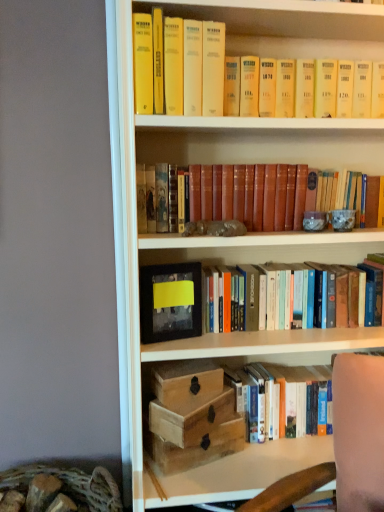
Measure the distance between point (271, 370) and camera.

They are 4.73 feet apart.

The width and height of the screenshot is (384, 512). What do you see at coordinates (193, 415) in the screenshot?
I see `wooden box at center, marked as the 1th box in a bottom-to-top arrangement` at bounding box center [193, 415].

Where is `matte black picture frame at center`? The width and height of the screenshot is (384, 512). matte black picture frame at center is located at coordinates (170, 302).

Which is behind, point (182, 324) or point (280, 323)?

The point (280, 323) is more distant.

In the scene shown: Does matte black picture frame at center have a lesser width compared to hardcover books at center, placed as the second book when sorted from top to bottom?

Yes.

Does matte black picture frame at center appear on the right side of hardcover books at center, arranged as the 2th book when ordered from the bottom?

Incorrect, matte black picture frame at center is not on the right side of hardcover books at center, arranged as the 2th book when ordered from the bottom.

Can you see matte black picture frame at center touching hardcover books at center, arranged as the 2th book when ordered from the bottom?

No.

From a real-world perspective, which object stands above the other?

wooden box at center, from a real-world perspective.

Between wooden box at center and wooden box at center, marked as the 1th box in a bottom-to-top arrangement, which one has larger width?

wooden box at center, marked as the 1th box in a bottom-to-top arrangement, is wider.

Is wooden box at center turned away from wooden box at center, the 2th box in the top-to-bottom sequence?

wooden box at center does not have its back to wooden box at center, the 2th box in the top-to-bottom sequence.

Does wooden box at center have a larger size compared to wooden box at center, the 2th box in the top-to-bottom sequence?

No, wooden box at center is not bigger than wooden box at center, the 2th box in the top-to-bottom sequence.

Is wooden box at center with leather-bound book at center, arranged as the 3th book when ordered from the bottom?

No, wooden box at center is not with leather-bound book at center, arranged as the 3th book when ordered from the bottom.

At what (x,y) coordinates should I click in order to perform the action: click on paperback book located on the left of leather-bound book at center, acting as the 1th book starting from the top. Please return your answer as a coordinate pair (x, y). The image size is (384, 512). Looking at the image, I should click on (185, 380).

Which is more distant, [193,372] or [187,198]?

Positioned behind is point [193,372].

From the image's perspective, is wooden box at center above or below leather-bound book at center, acting as the 1th book starting from the top?

wooden box at center is situated lower than leather-bound book at center, acting as the 1th book starting from the top, in the image.

From the image's perspective, is wooden box at lower center, the 2th box when ordered from bottom to top, located above or below wooden box at center?

wooden box at lower center, the 2th box when ordered from bottom to top, is situated lower than wooden box at center in the image.

Consider the image. Measure the distance from wooden box at lower center, the 2th box when ordered from bottom to top, to wooden box at center.

wooden box at lower center, the 2th box when ordered from bottom to top, and wooden box at center are 2.28 inches apart.

Who is taller, wooden box at lower center, the 1th box positioned from the top, or wooden box at center?

With more height is wooden box at lower center, the 1th box positioned from the top.

How many degrees apart are the facing directions of wooden box at lower center, the 2th box when ordered from bottom to top, and wooden box at center?

20.2 degrees separate the facing orientations of wooden box at lower center, the 2th box when ordered from bottom to top, and wooden box at center.

Which is more to the left, wooden box at center, the 2th box in the top-to-bottom sequence, or matte black picture frame at center?

Positioned to the left is matte black picture frame at center.

The image size is (384, 512). I want to click on picture frame behind the wooden box at center, marked as the 1th box in a bottom-to-top arrangement, so click(170, 302).

Is wooden box at center, marked as the 1th box in a bottom-to-top arrangement, placed right next to matte black picture frame at center?

No, wooden box at center, marked as the 1th box in a bottom-to-top arrangement, is not making contact with matte black picture frame at center.

From a real-world perspective, which object rests below the other?

wooden box at center, the 2th box in the top-to-bottom sequence.

Considering the relative sizes of wooden box at lower center, the 1th box positioned from the top, and matte black picture frame at center in the image provided, is wooden box at lower center, the 1th box positioned from the top, bigger than matte black picture frame at center?

Indeed, wooden box at lower center, the 1th box positioned from the top, has a larger size compared to matte black picture frame at center.

How many degrees apart are the facing directions of wooden box at lower center, the 1th box positioned from the top, and matte black picture frame at center?

36.6 degrees.

Is wooden box at lower center, the 2th box when ordered from bottom to top, placed right next to matte black picture frame at center?

wooden box at lower center, the 2th box when ordered from bottom to top, and matte black picture frame at center are clearly separated.

Between point (363, 306) and point (295, 185), which one is positioned behind?

The point (363, 306) is farther.

Considering the relative positions of hardcover books at center, arranged as the 2th book when ordered from the bottom, and leather-bound book at center, acting as the 1th book starting from the top, in the image provided, is hardcover books at center, arranged as the 2th book when ordered from the bottom, to the left or to the right of leather-bound book at center, acting as the 1th book starting from the top,?

hardcover books at center, arranged as the 2th book when ordered from the bottom, is positioned on leather-bound book at center, acting as the 1th book starting from the top,'s right side.

The height and width of the screenshot is (512, 384). What are the coordinates of `book that is above the hardcover books at center, placed as the second book when sorted from top to bottom (from a real-world perspective)` in the screenshot? It's located at (200, 188).

Which object is thinner, hardcover books at center, arranged as the 2th book when ordered from the bottom, or leather-bound book at center, arranged as the 3th book when ordered from the bottom?

leather-bound book at center, arranged as the 3th book when ordered from the bottom, is thinner.

Where is `picture frame in front of the hardcover books at center, arranged as the 2th book when ordered from the bottom`? picture frame in front of the hardcover books at center, arranged as the 2th book when ordered from the bottom is located at coordinates (170, 302).

Where is `the 2nd box below the wooden box at center (from the image's perspective)`? This screenshot has width=384, height=512. the 2nd box below the wooden box at center (from the image's perspective) is located at coordinates (193, 415).

From the image, which object appears to be nearer to wooden box at center, wooden box at lower center, the 1th box positioned from the top, or wooden box at center, marked as the 1th box in a bottom-to-top arrangement?

wooden box at lower center, the 1th box positioned from the top, is closer to wooden box at center.

From the image, which object appears to be nearer to wooden box at lower center, the 1th box positioned from the top, matte black picture frame at center or hardcover books at center, placed as the second book when sorted from top to bottom?

matte black picture frame at center lies closer to wooden box at lower center, the 1th box positioned from the top, than the other object.

Which object lies further to the anchor point wooden box at lower center, the 1th box positioned from the top, wooden box at center or leather-bound book at center, arranged as the 3th book when ordered from the bottom?

Among the two, leather-bound book at center, arranged as the 3th book when ordered from the bottom, is located further to wooden box at lower center, the 1th box positioned from the top.

Considering their positions, is leather-bound book at center, arranged as the 3th book when ordered from the bottom, positioned closer to hardcover books at center, arranged as the 2th book when ordered from the bottom, than wooden box at center?

Among the two, leather-bound book at center, arranged as the 3th book when ordered from the bottom, is located nearer to hardcover books at center, arranged as the 2th book when ordered from the bottom.

Looking at the image, which one is located further to hardcover books at center, placed as the second book when sorted from top to bottom, matte black picture frame at center or wooden box at lower center, the 2th box when ordered from bottom to top?

wooden box at lower center, the 2th box when ordered from bottom to top, is positioned further to the anchor hardcover books at center, placed as the second book when sorted from top to bottom.

Considering their positions, is hardcover books at center, placed as the second book when sorted from top to bottom, positioned further to hardcover book at lower right, the third book viewed from the top, than wooden box at center?

Among the two, wooden box at center is located further to hardcover book at lower right, the third book viewed from the top.

Based on their spatial positions, is leather-bound book at center, arranged as the 3th book when ordered from the bottom, or matte black picture frame at center closer to wooden box at center?

The object closer to wooden box at center is matte black picture frame at center.

From the picture: When comparing their distances from hardcover book at lower right, positioned as the 1th book in bottom-to-top order, does wooden box at center or matte black picture frame at center seem closer?

Among the two, wooden box at center is located nearer to hardcover book at lower right, positioned as the 1th book in bottom-to-top order.

Where is `picture frame between leather-bound book at center, arranged as the 3th book when ordered from the bottom, and wooden box at center in the up-down direction`? This screenshot has height=512, width=384. picture frame between leather-bound book at center, arranged as the 3th book when ordered from the bottom, and wooden box at center in the up-down direction is located at coordinates (170, 302).

The image size is (384, 512). Find the location of `paperback book between hardcover books at center, arranged as the 2th book when ordered from the bottom, and wooden box at center, the 2th box in the top-to-bottom sequence, from top to bottom`. paperback book between hardcover books at center, arranged as the 2th book when ordered from the bottom, and wooden box at center, the 2th box in the top-to-bottom sequence, from top to bottom is located at coordinates (185, 380).

Identify the location of box between leather-bound book at center, acting as the 1th book starting from the top, and hardcover book at lower right, the third book viewed from the top, in the up-down direction. This screenshot has width=384, height=512. (191, 417).

Find the location of a particular element. This screenshot has height=512, width=384. book between hardcover books at center, placed as the second book when sorted from top to bottom, and wooden box at center, the 2th box in the top-to-bottom sequence, vertically is located at coordinates (303, 399).